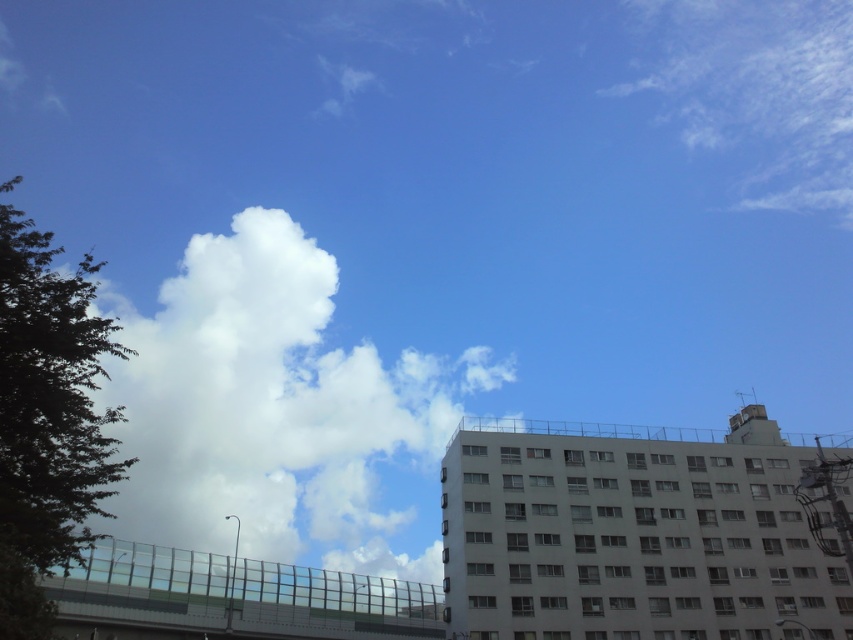
You are a GUI agent. You are given a task and a screenshot of the screen. Output one action in this format:
    pyautogui.click(x=<x>, y=<y>)
    Task: Click on the white fluffy cloud at upper right
    
    Given the screenshot: What is the action you would take?
    pyautogui.click(x=758, y=90)

Who is taller, white fluffy cloud at upper right or transparent glass overpass at lower left?

white fluffy cloud at upper right is taller.

Who is more forward, [824,60] or [276,573]?

Point [276,573] is in front.

Where is `white fluffy cloud at upper right`? white fluffy cloud at upper right is located at coordinates (758, 90).

Which is behind, point (196, 525) or point (756, 205)?

The point (756, 205) is behind.

Measure the distance between white fluffy cloud at upper left and camera.

white fluffy cloud at upper left and camera are 150.89 meters apart.

Locate an element on the screen. This screenshot has width=853, height=640. white fluffy cloud at upper left is located at coordinates (276, 408).

Measure the distance between white fluffy cloud at upper left and transparent glass overpass at lower left.

white fluffy cloud at upper left and transparent glass overpass at lower left are 86.45 meters apart.

Locate an element on the screen. This screenshot has width=853, height=640. white fluffy cloud at upper left is located at coordinates (276, 408).

Image resolution: width=853 pixels, height=640 pixels. I want to click on white fluffy cloud at upper left, so click(276, 408).